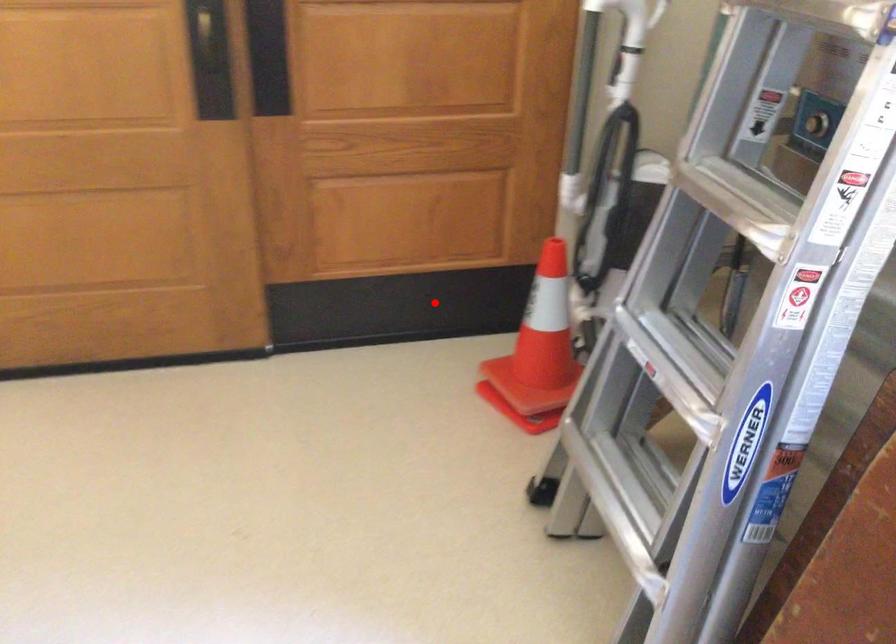
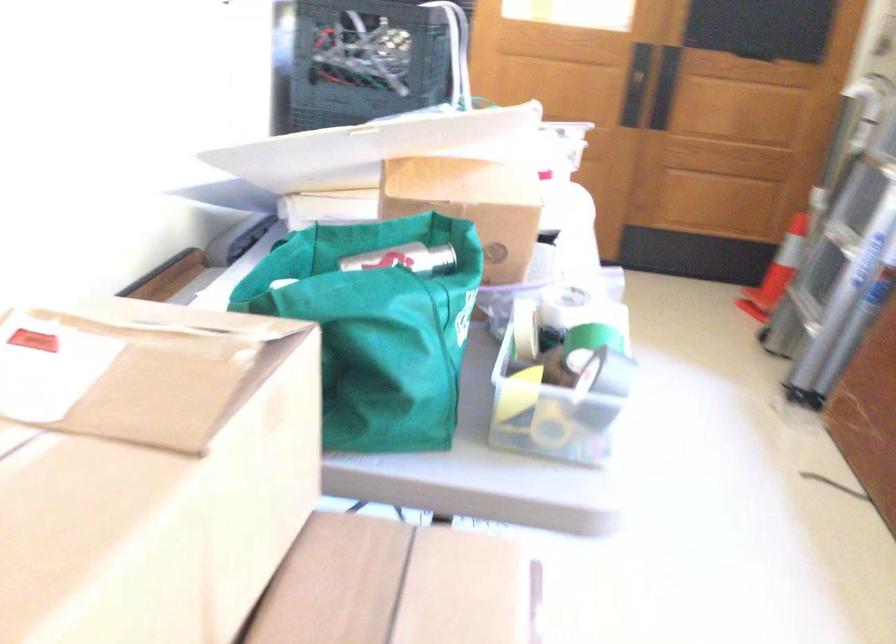
Question: I am providing you with two images of the same scene from different viewpoints. Given a red point in image1, look at the same physical point in image2. Is it:

Choices:
 (A) Closer to the viewpoint
 (B) Farther from the viewpoint

Answer: (B)